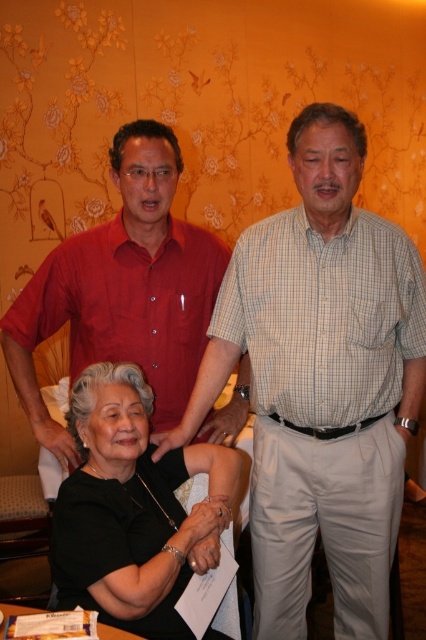
Question: Is light blue checkered shirt at center in front of white paper at lower center?

Choices:
 (A) yes
 (B) no

Answer: (B)

Question: Can you confirm if matte red shirt at upper left is positioned above black matte shirt at center?

Choices:
 (A) yes
 (B) no

Answer: (A)

Question: Based on their relative distances, which object is nearer to the white paper at lower center?

Choices:
 (A) black matte shirt at center
 (B) light blue checkered shirt at center
 (C) matte red shirt at upper left

Answer: (A)

Question: Which object is the closest to the light blue checkered shirt at center?

Choices:
 (A) matte red shirt at upper left
 (B) white paper at lower center

Answer: (A)

Question: Is light blue checkered shirt at center positioned in front of matte red shirt at upper left?

Choices:
 (A) no
 (B) yes

Answer: (B)

Question: Which is nearer to the matte red shirt at upper left?

Choices:
 (A) light blue checkered shirt at center
 (B) black matte shirt at center

Answer: (B)